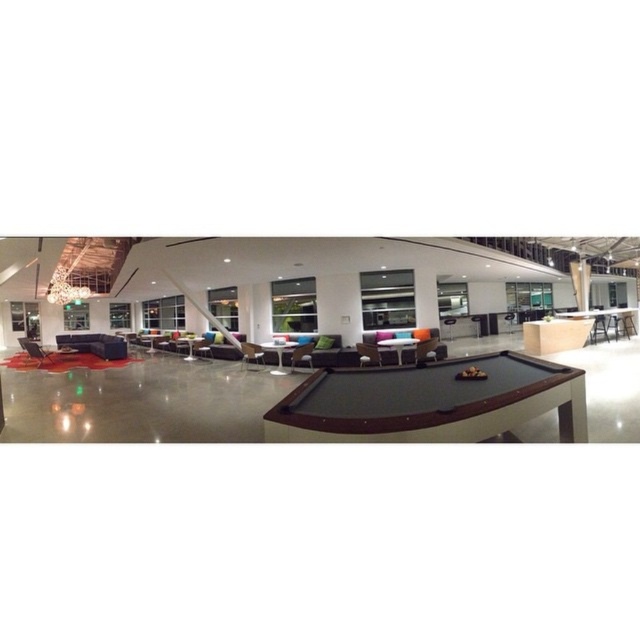
You are a maintenance worker needing to move a 10 meter long extension cord from the dark brown wood pool table at center to the matte black armchair at left. Can you safely lay the cord without it being a tripping hazard? Please explain your reasoning.

The distance between the dark brown wood pool table at center and the matte black armchair at left is 9.74 meters. Since the extension cord is 10 meters long, it would extend beyond the required distance. However, laying the full length might leave excess cord that could pose a tripping hazard. To avoid this, you should coil the extra cord neatly near either the pool table or the armchair, ensuring only the necessary length is stretched between them.

You are planning to host a meeting in this recreational area and need to seat two people comfortably. Given the space constraints, which of the two armchairs, the matte black armchair at left or the matte gray armchair at center, would allow for more personal space between the two attendees?

The matte black armchair at left is wider than the matte gray armchair at center, so placing the two attendees in the matte black armchair at left would provide more personal space between them due to its larger width.

You are standing at the entrance of the recreational area and see a point marked at coordinates (252, 353). Which object is this point located on?

The point at coordinates (252, 353) is located on the matte gray armchair at center.